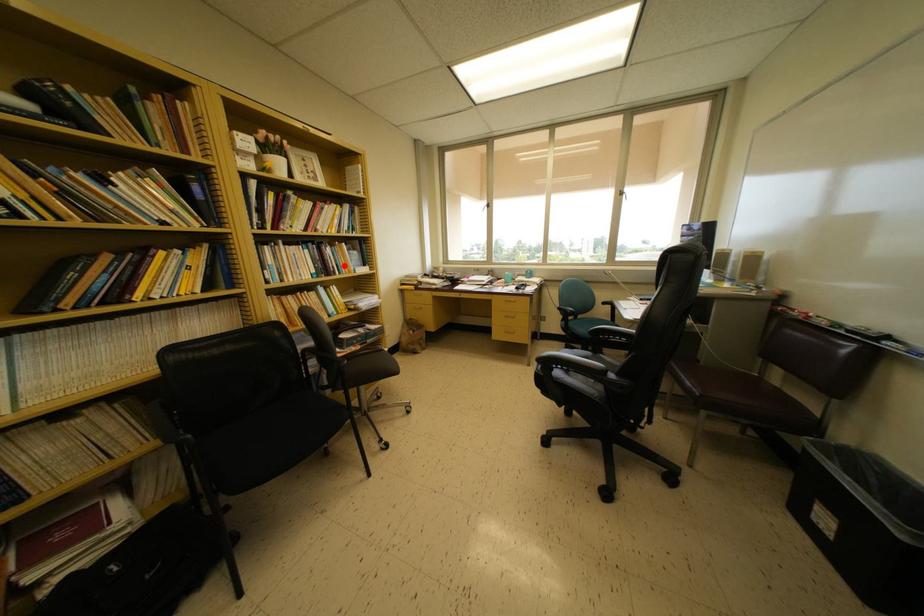
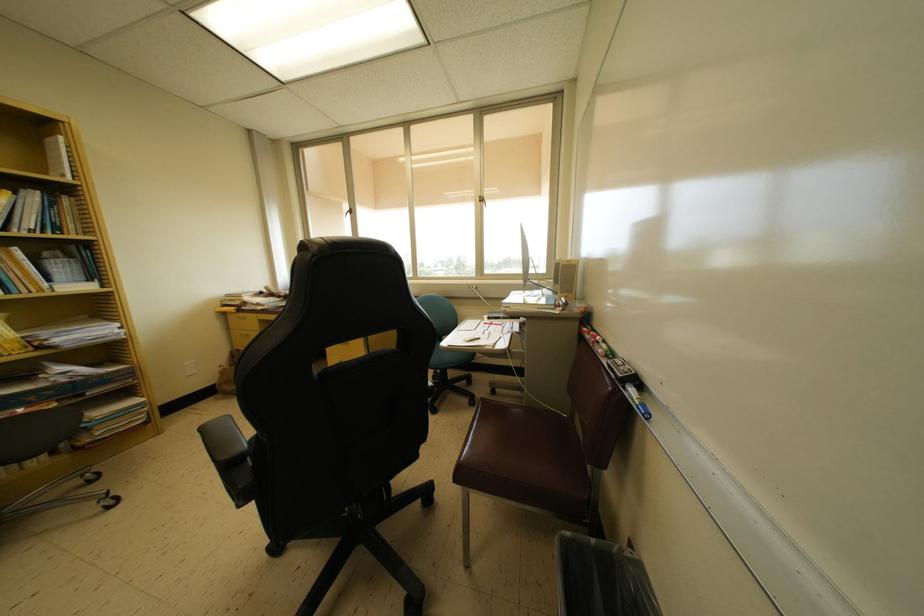
Question: I am providing you with two images of the same scene from different viewpoints. A red point is shown in image1. For the corresponding object point in image2, is it positioned nearer or farther from the camera?

Choices:
 (A) Nearer
 (B) Farther

Answer: (B)